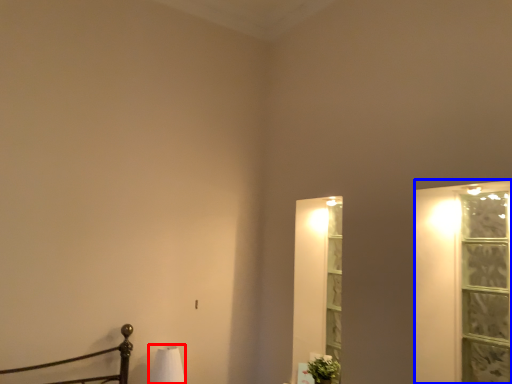
Question: Which object is closer to the camera taking this photo, table lamp (highlighted by a red box) or window frame (highlighted by a blue box)?

Choices:
 (A) table lamp
 (B) window frame

Answer: (B)